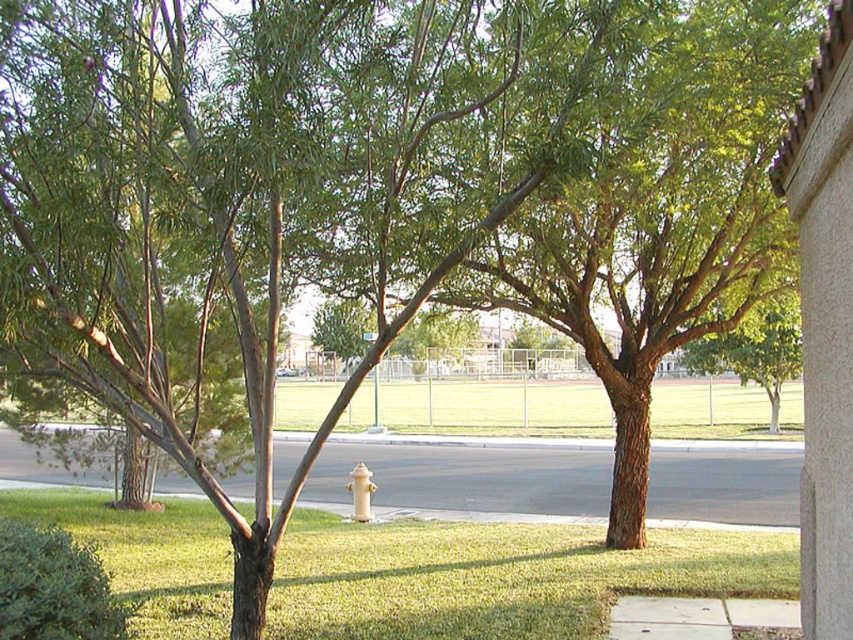
Is gray concrete curb at center shorter than yellow matte hydrant at center?

Correct, gray concrete curb at center is not as tall as yellow matte hydrant at center.

What do you see at coordinates (469, 440) in the screenshot?
I see `gray concrete curb at center` at bounding box center [469, 440].

Is point (473, 444) positioned before point (358, 502)?

No.

Find the location of `gray concrete curb at center`. gray concrete curb at center is located at coordinates [x=469, y=440].

Is green grass at lower center to the left of yellow matte hydrant at center from the viewer's perspective?

Indeed, green grass at lower center is positioned on the left side of yellow matte hydrant at center.

Does green grass at lower center have a lesser height compared to yellow matte hydrant at center?

Incorrect, green grass at lower center's height does not fall short of yellow matte hydrant at center's.

Is point (328, 593) positioned in front of point (364, 500)?

Yes, it is.

Locate an element on the screen. green grass at lower center is located at coordinates (498, 579).

Can you confirm if green grass at lower center is positioned to the right of white asphalt pavement at center?

Correct, you'll find green grass at lower center to the right of white asphalt pavement at center.

Can you confirm if green grass at lower center is positioned to the left of white asphalt pavement at center?

No, green grass at lower center is not to the left of white asphalt pavement at center.

Between point (416, 627) and point (694, 515), which one is positioned in front?

Point (416, 627)

In order to click on green grass at lower center in this screenshot , I will do `click(498, 579)`.